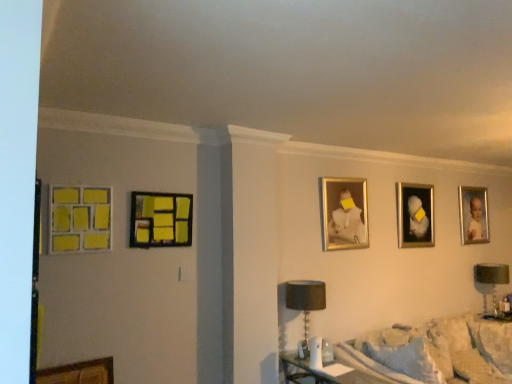
Question: From a real-world perspective, is matte wood picture frame at left, acting as the fourth picture frame starting from the back, positioned under fluffy white blanket at lower right based on gravity?

Choices:
 (A) yes
 (B) no

Answer: (B)

Question: Can you confirm if matte wood picture frame at left, marked as the second picture frame in a front-to-back arrangement, is positioned to the right of fluffy white blanket at lower right?

Choices:
 (A) yes
 (B) no

Answer: (B)

Question: Is matte wood picture frame at left, acting as the fourth picture frame starting from the back, completely or partially outside of fluffy white blanket at lower right?

Choices:
 (A) no
 (B) yes

Answer: (B)

Question: Does matte wood picture frame at left, marked as the second picture frame in a front-to-back arrangement, have a greater width compared to fluffy white blanket at lower right?

Choices:
 (A) yes
 (B) no

Answer: (B)

Question: Considering the relative sizes of matte wood picture frame at left, the 2th picture frame in the left-to-right sequence, and fluffy white blanket at lower right in the image provided, is matte wood picture frame at left, the 2th picture frame in the left-to-right sequence, shorter than fluffy white blanket at lower right?

Choices:
 (A) yes
 (B) no

Answer: (A)

Question: Considering the relative sizes of matte wood picture frame at left, marked as the second picture frame in a front-to-back arrangement, and fluffy white blanket at lower right in the image provided, is matte wood picture frame at left, marked as the second picture frame in a front-to-back arrangement, taller than fluffy white blanket at lower right?

Choices:
 (A) no
 (B) yes

Answer: (A)

Question: From a real-world perspective, is gold-framed portrait at upper right, positioned as the 4th picture frame in left-to-right order, beneath matte wood picture frame at left, acting as the fourth picture frame starting from the back?

Choices:
 (A) yes
 (B) no

Answer: (B)

Question: From the image's perspective, is gold-framed portrait at upper right, positioned as the 4th picture frame in left-to-right order, under matte wood picture frame at left, the fourth picture frame viewed from the right?

Choices:
 (A) no
 (B) yes

Answer: (B)

Question: Can you confirm if gold-framed portrait at upper right, positioned as the second picture frame in back-to-front order, is smaller than matte wood picture frame at left, acting as the fourth picture frame starting from the back?

Choices:
 (A) no
 (B) yes

Answer: (A)

Question: Is gold-framed portrait at upper right, which ranks as the second picture frame in right-to-left order, at the right side of matte wood picture frame at left, acting as the fourth picture frame starting from the back?

Choices:
 (A) yes
 (B) no

Answer: (A)

Question: Is gold-framed portrait at upper right, positioned as the 4th picture frame in left-to-right order, oriented towards matte wood picture frame at left, the 2th picture frame in the left-to-right sequence?

Choices:
 (A) yes
 (B) no

Answer: (B)

Question: Is matte wood picture frame at left, the 2th picture frame in the left-to-right sequence, at the back of gold-framed portrait at upper right, positioned as the second picture frame in back-to-front order?

Choices:
 (A) no
 (B) yes

Answer: (A)

Question: Does green fabric lampshade at right, which is counted as the 2th table lamp, starting from the front, appear on the left side of black fabric lampshade at lower center, the second table lamp in the back-to-front sequence?

Choices:
 (A) no
 (B) yes

Answer: (A)